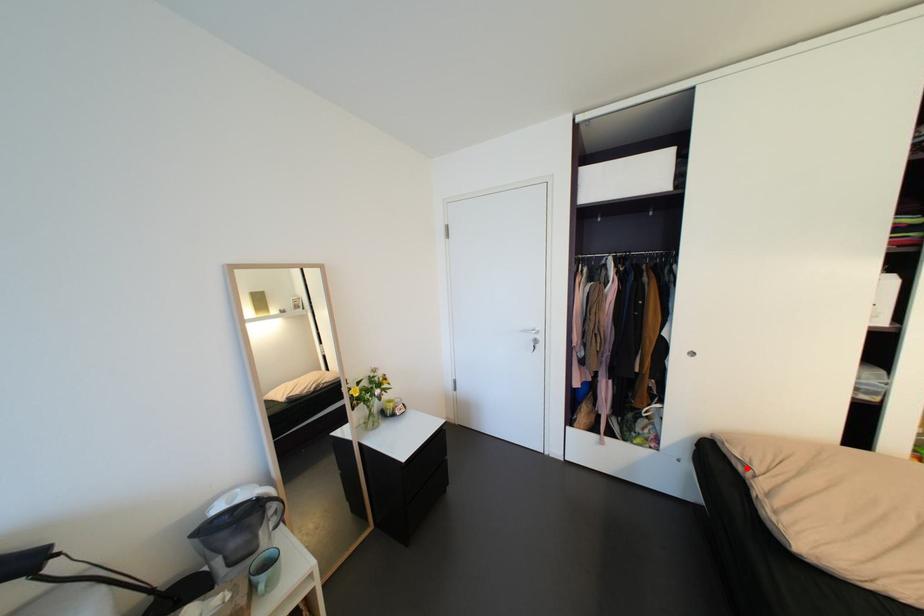
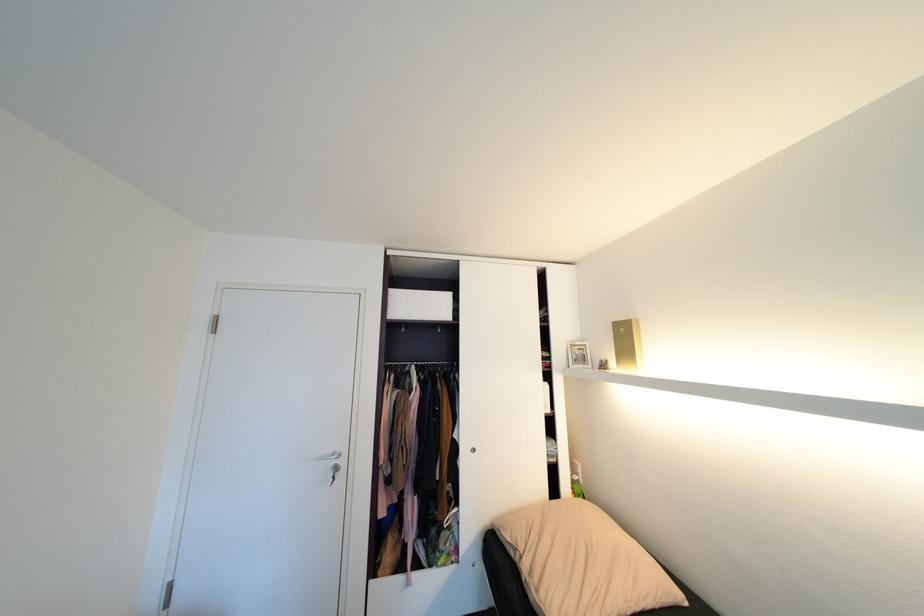
In the second image, find the point that corresponds to the highlighted location in the first image.

(518, 554)